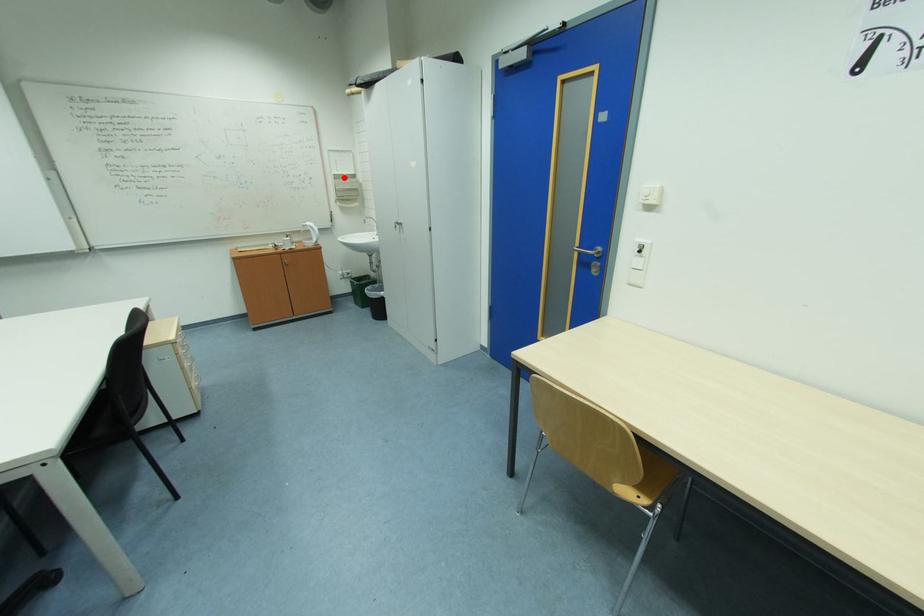
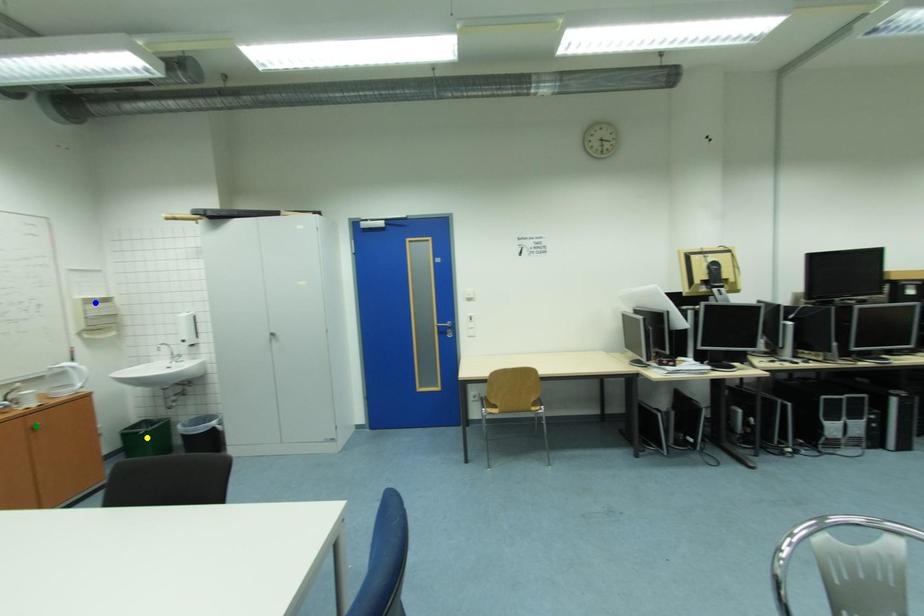
Question: I am providing you with two images of the same scene from different viewpoints. A red point is marked on the first image. You are given multiple points on the second image. Which point in image 2 represents the same 3d spot as the red point in image 1?

Choices:
 (A) blue point
 (B) yellow point
 (C) green point

Answer: (A)